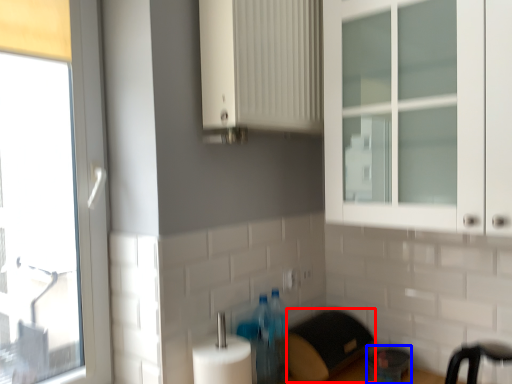
Question: Which object is further to the camera taking this photo, appliance (highlighted by a red box) or appliance (highlighted by a blue box)?

Choices:
 (A) appliance
 (B) appliance

Answer: (B)